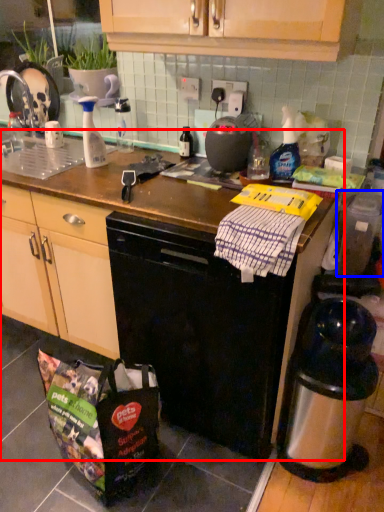
Question: Among these objects, which one is nearest to the camera, counter top (highlighted by a red box) or appliance (highlighted by a blue box)?

Choices:
 (A) counter top
 (B) appliance

Answer: (A)